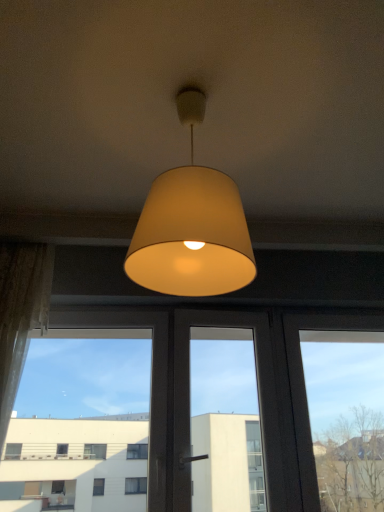
Question: Is transparent glass window at center in front of or behind matte beige lampshade at center in the image?

Choices:
 (A) front
 (B) behind

Answer: (B)

Question: Is transparent glass window at center spatially inside matte beige lampshade at center, or outside of it?

Choices:
 (A) outside
 (B) inside

Answer: (A)

Question: Which object is positioned closest to the matte beige lampshade at center?

Choices:
 (A) transparent glass window at center
 (B) sheer lace curtain at left

Answer: (B)

Question: Which of these objects is positioned farthest from the sheer lace curtain at left?

Choices:
 (A) transparent glass window at center
 (B) matte beige lampshade at center

Answer: (B)